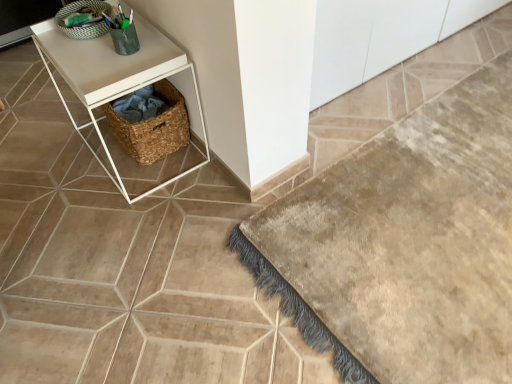
Locate an element on the screen. This screenshot has width=512, height=384. vacant space situated on the left part of woven brown basket at center, the second basket viewed from the top is located at coordinates (67, 167).